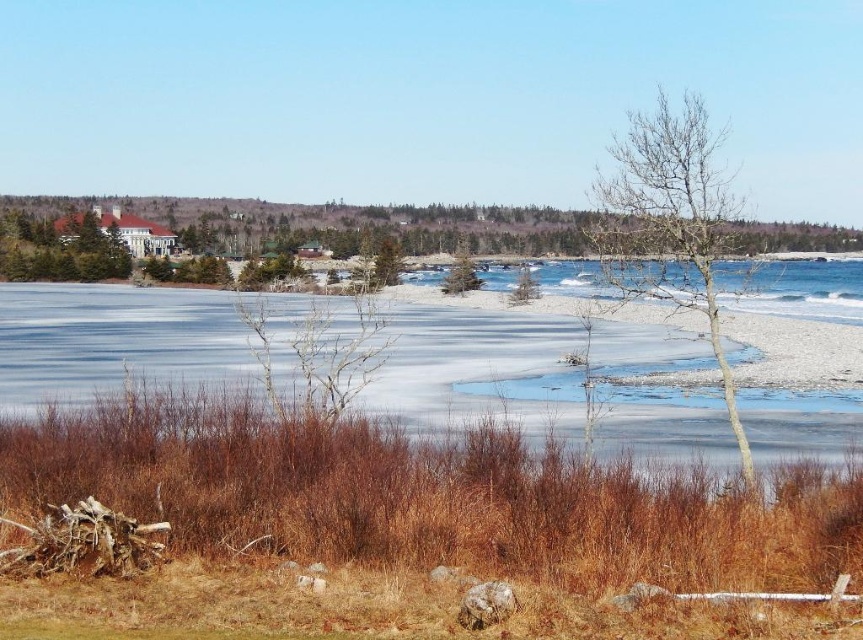
You are standing in a coastal landscape and want to walk towards the green textured pine tree at center and the green matte tree at center. Which tree will you reach first?

You will reach the green textured pine tree at center first because it is closer to you than the green matte tree at center.

You are standing at the edge of the frozen ice at center and want to reach the bare wood tree at center. Based on the scene description, which direction should you move to get closer to the tree?

The frozen ice at center is not as tall as the bare wood tree at center, so you should move towards the direction of the tree to get closer.

You are a bird looking for a nesting spot. You see a bare wood tree at center and a green matte tree at center. Which tree would you choose if you want a larger tree to build your nest?

The bare wood tree at center is bigger than the green matte tree at center, so you should choose the bare wood tree at center for a larger nesting spot.